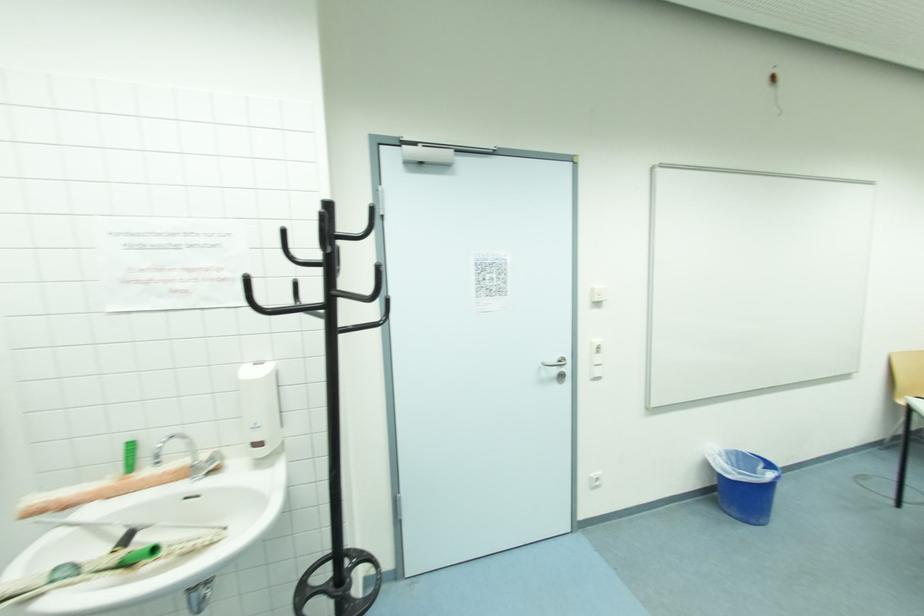
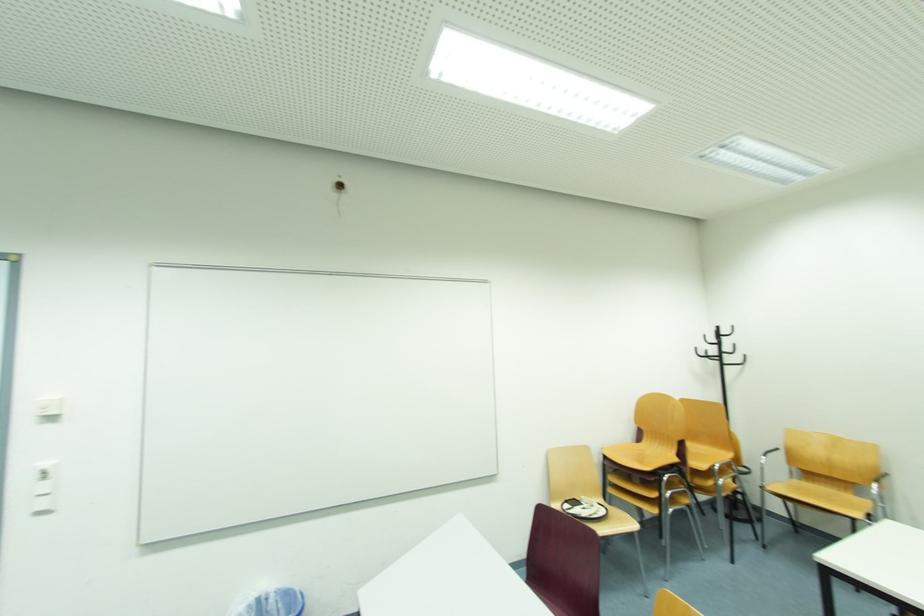
Question: In a continuous first-person perspective shot, in which direction is the camera moving?

Choices:
 (A) Left
 (B) Right
 (C) Forward
 (D) Backward

Answer: (B)